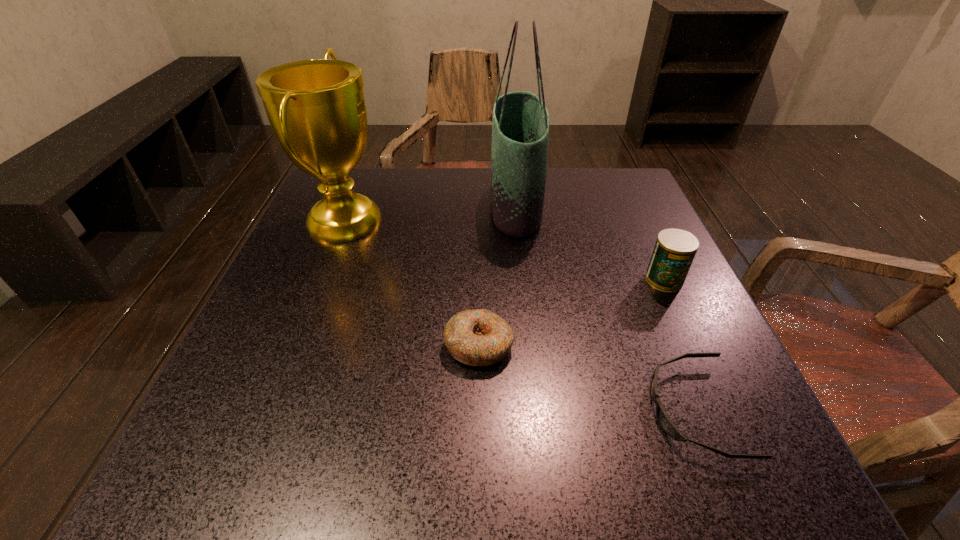
I want to click on object present at the near right corner, so coord(665,422).

Identify the location of vacant region at the far edge of the desktop. This screenshot has width=960, height=540. (422, 181).

Locate an element on the screen. The width and height of the screenshot is (960, 540). free space at the near edge is located at coordinates (376, 473).

Where is `blank area at the left edge`? blank area at the left edge is located at coordinates (301, 372).

Where is `vacant area at the right edge`? This screenshot has width=960, height=540. vacant area at the right edge is located at coordinates (725, 390).

Locate an element on the screen. This screenshot has height=540, width=960. vacant area at the far left corner is located at coordinates (373, 171).

At what (x,y) coordinates should I click in order to perform the action: click on vacant space at the far right corner of the desktop. Please return your answer as a coordinate pair (x, y). Looking at the image, I should click on (595, 211).

The height and width of the screenshot is (540, 960). I want to click on vacant space at the near right corner of the desktop, so click(x=698, y=487).

You are a GUI agent. You are given a task and a screenshot of the screen. Output one action in this format:
    pyautogui.click(x=<x>, y=<y>)
    Task: Click on the free space between the shortest object and the fourth tallest object
    This screenshot has height=540, width=960.
    Given the screenshot: What is the action you would take?
    pyautogui.click(x=587, y=377)

The height and width of the screenshot is (540, 960). I want to click on free space between the shortest object and the can, so click(680, 345).